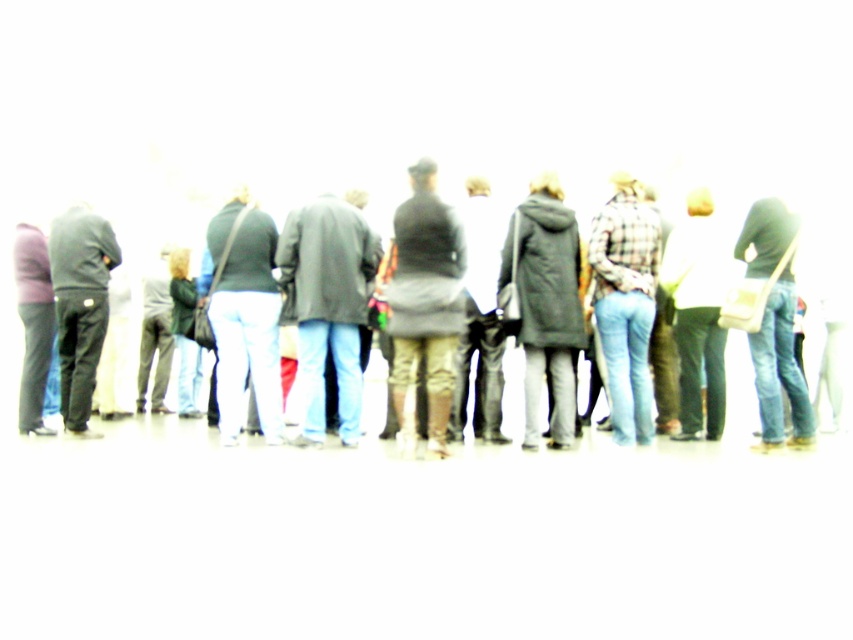
Question: Which point is farther to the camera?

Choices:
 (A) dark gray pants at left
 (B) dark gray coat at center
 (C) plaid fabric shirt at center
 (D) matte black coat at center

Answer: (A)

Question: Does matte black coat at center appear over dark gray pants at left?

Choices:
 (A) yes
 (B) no

Answer: (A)

Question: Does matte black coat at center have a lesser width compared to plaid fabric shirt at center?

Choices:
 (A) yes
 (B) no

Answer: (B)

Question: Based on their relative distances, which object is nearer to the dark gray coat at center?

Choices:
 (A) matte black coat at center
 (B) dark gray pants at left

Answer: (B)

Question: Can you confirm if dark gray coat at center is positioned to the left of plaid fabric shirt at center?

Choices:
 (A) yes
 (B) no

Answer: (A)

Question: Based on their relative distances, which object is farther from the plaid fabric shirt at center?

Choices:
 (A) matte black coat at center
 (B) dark gray coat at center

Answer: (A)